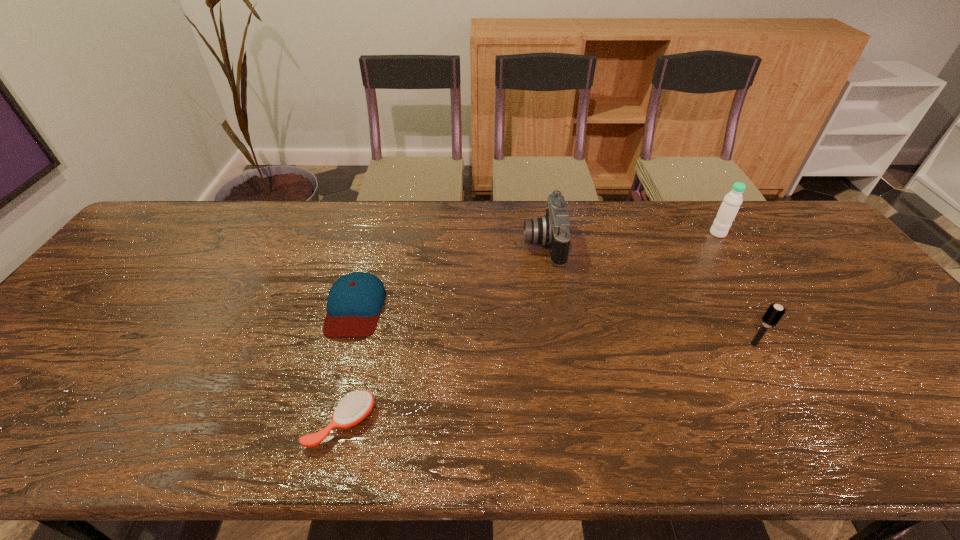
In order to click on free location at the left edge in this screenshot , I will do `click(23, 367)`.

In the image, there is a desktop. In order to click on vacant area at the right edge in this screenshot , I will do `click(832, 249)`.

I want to click on vacant area at the far left corner of the desktop, so click(x=175, y=235).

You are a GUI agent. You are given a task and a screenshot of the screen. Output one action in this format:
    pyautogui.click(x=<x>, y=<y>)
    Task: Click on the free spot at the far right corner of the desktop
    The image size is (960, 540).
    Given the screenshot: What is the action you would take?
    pyautogui.click(x=754, y=206)

Identify the location of empty space that is in between the farther hairbrush and the nearest object. (547, 384).

Find the location of a particular element. This screenshot has width=960, height=540. blank region between the rightmost object and the third object from right to left is located at coordinates (631, 239).

This screenshot has height=540, width=960. In order to click on vacant area that lies between the fourth object from left to right and the tallest object in this screenshot , I will do `click(735, 289)`.

You are a GUI agent. You are given a task and a screenshot of the screen. Output one action in this format:
    pyautogui.click(x=<x>, y=<y>)
    Task: Click on the vacant point located between the third object from right to left and the nearer hairbrush
    This screenshot has width=960, height=540.
    Given the screenshot: What is the action you would take?
    pyautogui.click(x=442, y=333)

Where is `free space between the camera and the shortest object`? The width and height of the screenshot is (960, 540). free space between the camera and the shortest object is located at coordinates (442, 333).

Identify the location of free space between the camera and the rightmost object. (631, 239).